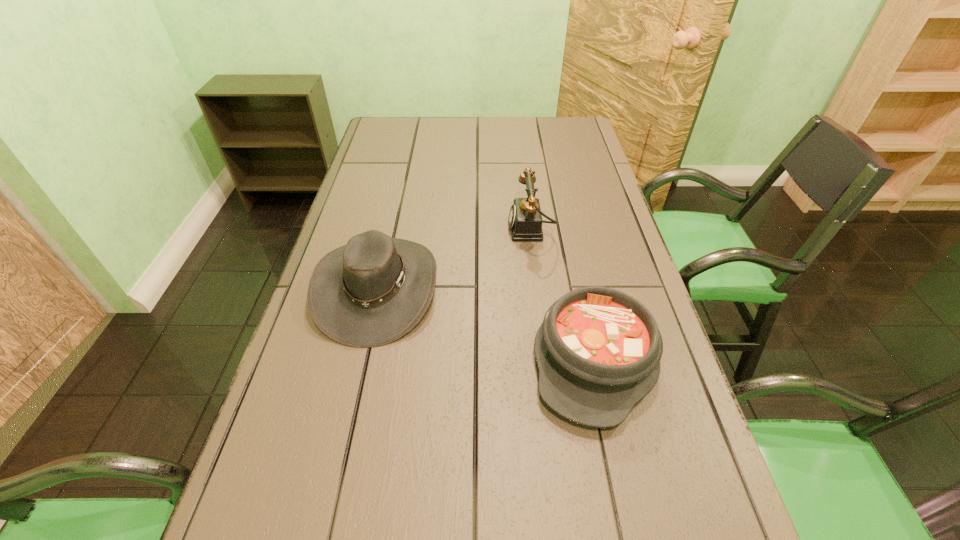
The image size is (960, 540). In order to click on free region located 0.280m on the front-facing side of the shopping bag in this screenshot , I will do `click(523, 200)`.

Locate an element on the screen. vacant area located 0.140m on the back of the farthest detergent is located at coordinates (509, 149).

The image size is (960, 540). I want to click on free space located 0.090m on the front surface of the bigger red detergent, so click(371, 406).

Locate an element on the screen. The image size is (960, 540). vacant space positioned on the front of the second farthest white detergent is located at coordinates (634, 428).

Identify the location of vacant space situated on the front surface of the right red detergent. (293, 355).

I want to click on vacant region located 0.240m on the front surface of the right red detergent, so click(347, 355).

The height and width of the screenshot is (540, 960). In order to click on free region located on the front surface of the right red detergent in this screenshot , I will do `click(371, 355)`.

Find the location of a particular element. This screenshot has height=540, width=960. object that is at the far edge is located at coordinates (480, 52).

Identify the location of shopping bag located at the left edge. The height and width of the screenshot is (540, 960). (391, 171).

Image resolution: width=960 pixels, height=540 pixels. In order to click on detergent situated at the left edge in this screenshot , I will do `click(275, 375)`.